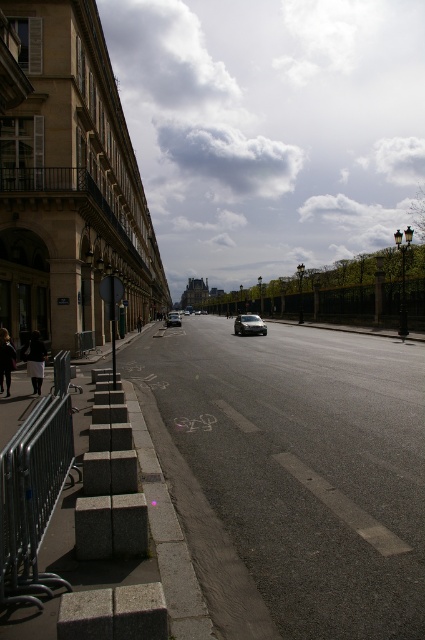
Question: Is black asphalt car at center to the right of shiny silver sedan at center from the viewer's perspective?

Choices:
 (A) yes
 (B) no

Answer: (A)

Question: Is the position of black asphalt car at center less distant than that of shiny silver sedan at center?

Choices:
 (A) no
 (B) yes

Answer: (B)

Question: Does satin black car at center have a greater width compared to shiny silver sedan at center?

Choices:
 (A) no
 (B) yes

Answer: (A)

Question: Which object appears closest to the camera in this image?

Choices:
 (A) satin black car at center
 (B) black asphalt car at center
 (C) silver metallic rail at lower left

Answer: (C)

Question: Which point is closer to the camera?

Choices:
 (A) (257, 412)
 (B) (234, 330)
 (C) (172, 320)

Answer: (A)

Question: Which object is the closest to the black asphalt car at center?

Choices:
 (A) silver metallic rail at lower left
 (B) shiny silver sedan at center

Answer: (A)